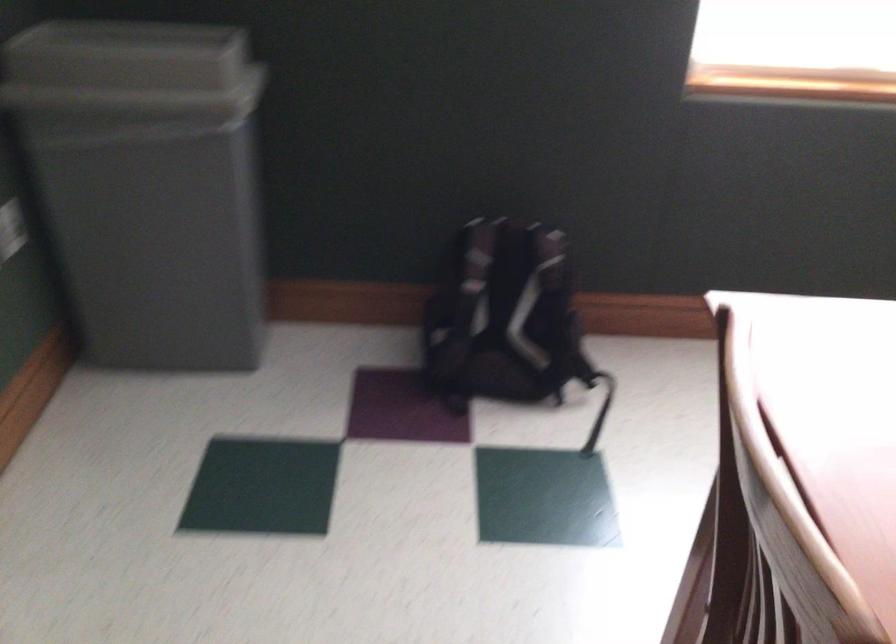
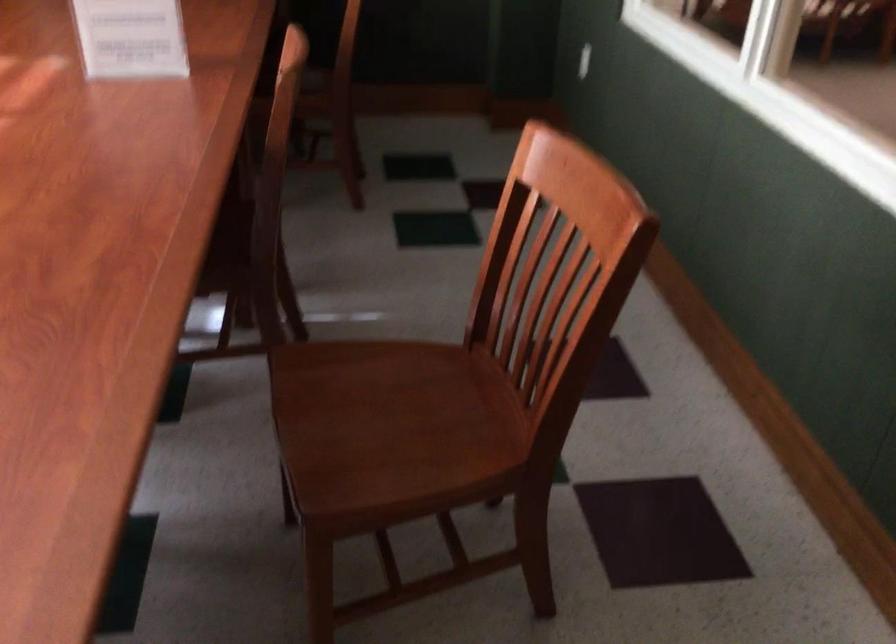
Based on the continuous images, in which direction is the camera rotating?

The camera's rotation is toward right-down.